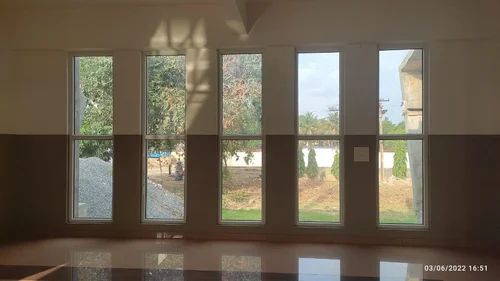
Image resolution: width=500 pixels, height=281 pixels. Find the location of `wall`. wall is located at coordinates pos(327,157).